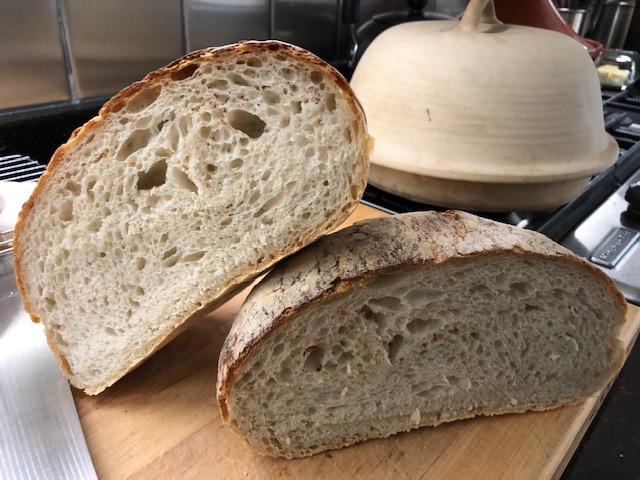
Where is `top of pot`? This screenshot has width=640, height=480. top of pot is located at coordinates (500, 85).